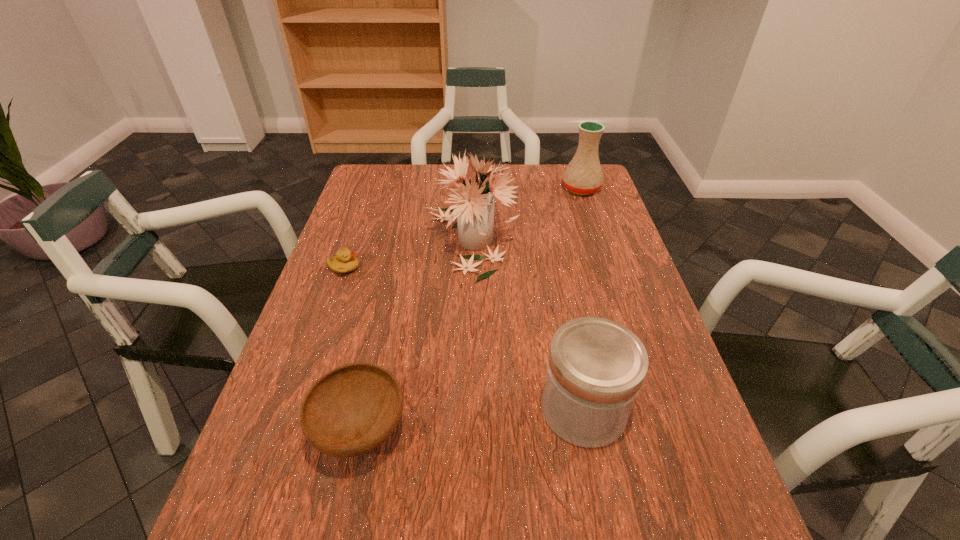
In the image, there is a desktop. Where is `vacant space at the right edge`? The width and height of the screenshot is (960, 540). vacant space at the right edge is located at coordinates (661, 360).

This screenshot has height=540, width=960. I want to click on vacant point at the far right corner, so click(555, 180).

You are a GUI agent. You are given a task and a screenshot of the screen. Output one action in this format:
    pyautogui.click(x=<x>, y=<y>)
    Task: Click on the empty location between the bowl and the pottery
    Image resolution: width=960 pixels, height=540 pixels.
    Given the screenshot: What is the action you would take?
    pyautogui.click(x=471, y=309)

Find the location of a particular element. The height and width of the screenshot is (540, 960). empty location between the bouquet and the shortest object is located at coordinates (408, 254).

Identify the location of free area in between the tallest object and the leftmost object. (408, 254).

At what (x,y) coordinates should I click in order to perform the action: click on empty space between the second tallest object and the second shortest object. Please return your answer as a coordinate pair (x, y). This screenshot has height=540, width=960. Looking at the image, I should click on (471, 309).

I want to click on unoccupied position between the bowl and the tallest object, so point(416,335).

Locate an element on the screen. blank region between the second shortest object and the farthest object is located at coordinates (471, 309).

You are a GUI agent. You are given a task and a screenshot of the screen. Output one action in this format:
    pyautogui.click(x=<x>, y=<y>)
    Task: Click on the unoccupied position between the second tallest object and the jar
    
    Given the screenshot: What is the action you would take?
    pyautogui.click(x=582, y=299)

Where is `unoccupied position between the fourth shortest object and the tallest object`? Image resolution: width=960 pixels, height=540 pixels. unoccupied position between the fourth shortest object and the tallest object is located at coordinates (526, 214).